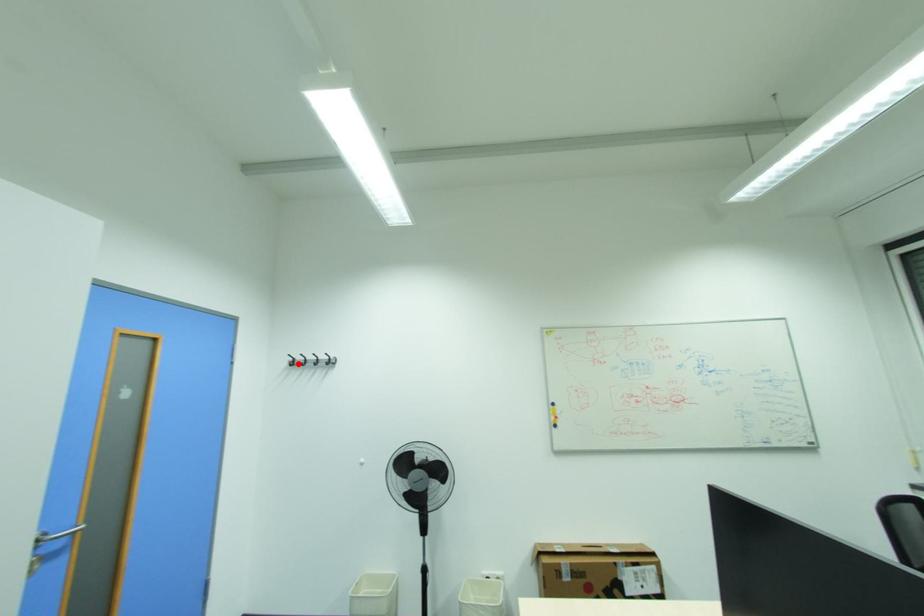
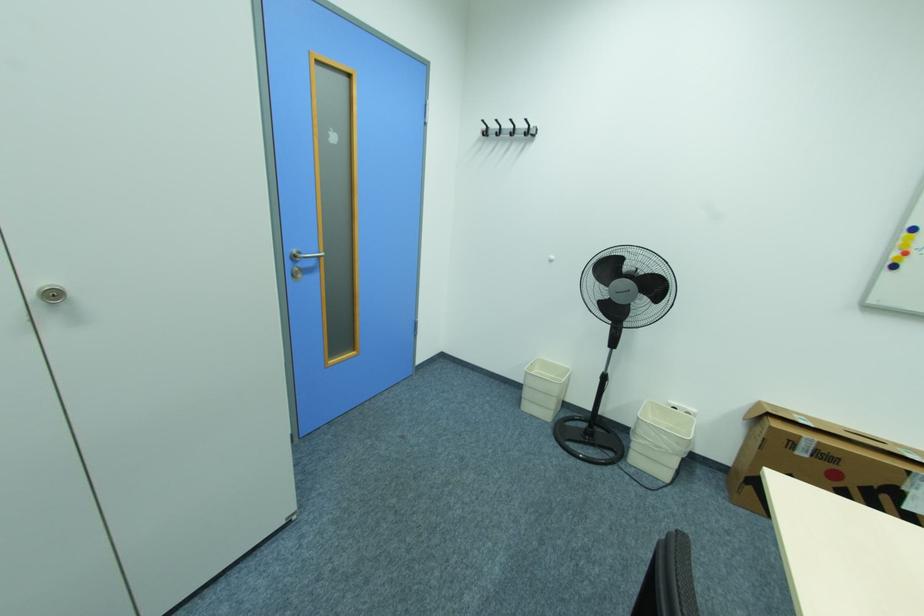
Locate, in the second image, the point that corresponds to the highlighted location in the first image.

(492, 132)